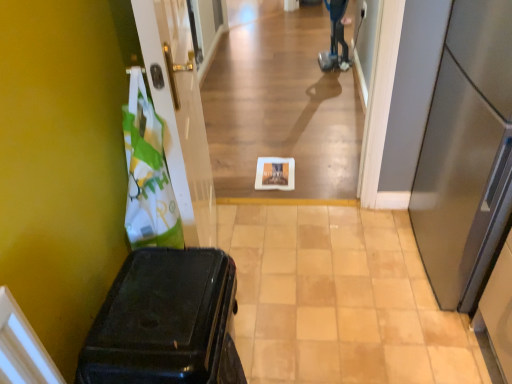
Question: Is shiny black suitcase at left looking in the opposite direction of blue plastic mobility scooter at upper center?

Choices:
 (A) no
 (B) yes

Answer: (A)

Question: Is shiny black suitcase at left closer to camera compared to blue plastic mobility scooter at upper center?

Choices:
 (A) yes
 (B) no

Answer: (A)

Question: Is shiny black suitcase at left located outside blue plastic mobility scooter at upper center?

Choices:
 (A) no
 (B) yes

Answer: (B)

Question: Is shiny black suitcase at left bigger than blue plastic mobility scooter at upper center?

Choices:
 (A) no
 (B) yes

Answer: (B)

Question: From the image's perspective, is shiny black suitcase at left over blue plastic mobility scooter at upper center?

Choices:
 (A) yes
 (B) no

Answer: (B)

Question: Is shiny black suitcase at left at the left side of blue plastic mobility scooter at upper center?

Choices:
 (A) yes
 (B) no

Answer: (A)

Question: Does white paper at center have a greater width compared to blue plastic mobility scooter at upper center?

Choices:
 (A) yes
 (B) no

Answer: (B)

Question: Does white paper at center have a lesser width compared to blue plastic mobility scooter at upper center?

Choices:
 (A) yes
 (B) no

Answer: (A)

Question: From the image's perspective, is white paper at center located above blue plastic mobility scooter at upper center?

Choices:
 (A) yes
 (B) no

Answer: (B)

Question: From a real-world perspective, is white paper at center beneath blue plastic mobility scooter at upper center?

Choices:
 (A) no
 (B) yes

Answer: (A)

Question: Can you confirm if white paper at center is positioned to the right of blue plastic mobility scooter at upper center?

Choices:
 (A) no
 (B) yes

Answer: (A)

Question: Could you tell me if white paper at center is turned towards blue plastic mobility scooter at upper center?

Choices:
 (A) no
 (B) yes

Answer: (A)

Question: Is white glossy plate at center to the right of blue plastic mobility scooter at upper center from the viewer's perspective?

Choices:
 (A) no
 (B) yes

Answer: (A)